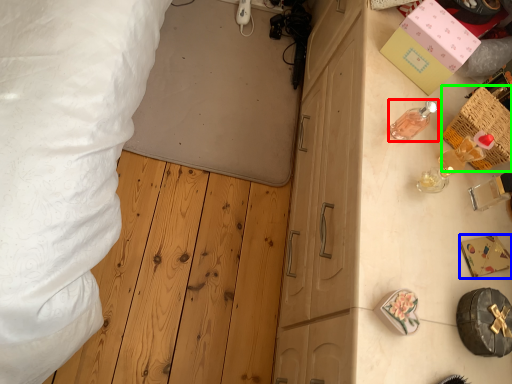
Question: Based on their relative distances, which object is farther from toiletry (highlighted by a red box)? Choose from box (highlighted by a blue box) and crate (highlighted by a green box).

Choices:
 (A) box
 (B) crate

Answer: (A)